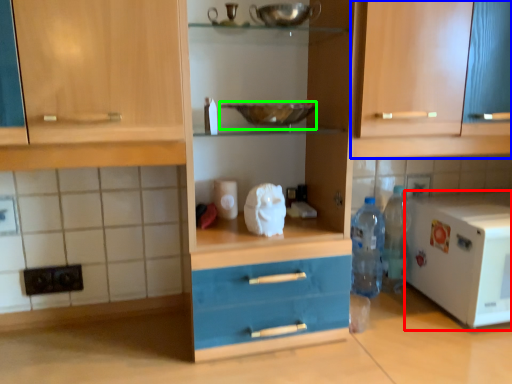
Question: Which object is the closest to the home appliance (highlighted by a red box)? Choose among these: cabinetry (highlighted by a blue box) or bowl (highlighted by a green box).

Choices:
 (A) cabinetry
 (B) bowl

Answer: (A)